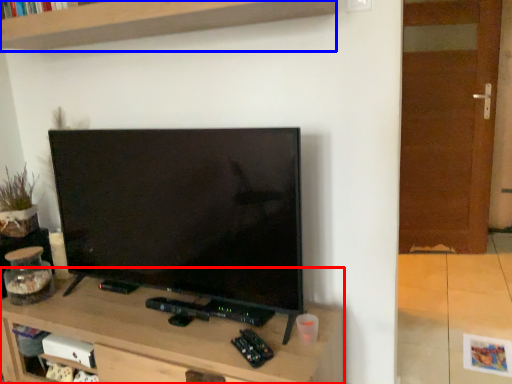
Question: Among these objects, which one is nearest to the camera, table (highlighted by a red box) or shelf (highlighted by a blue box)?

Choices:
 (A) table
 (B) shelf

Answer: (B)